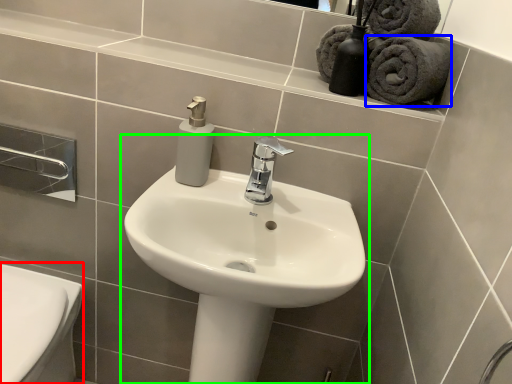
Question: Which is nearer to the bidet (highlighted by a red box)? bath towel (highlighted by a blue box) or sink (highlighted by a green box).

Choices:
 (A) bath towel
 (B) sink

Answer: (B)